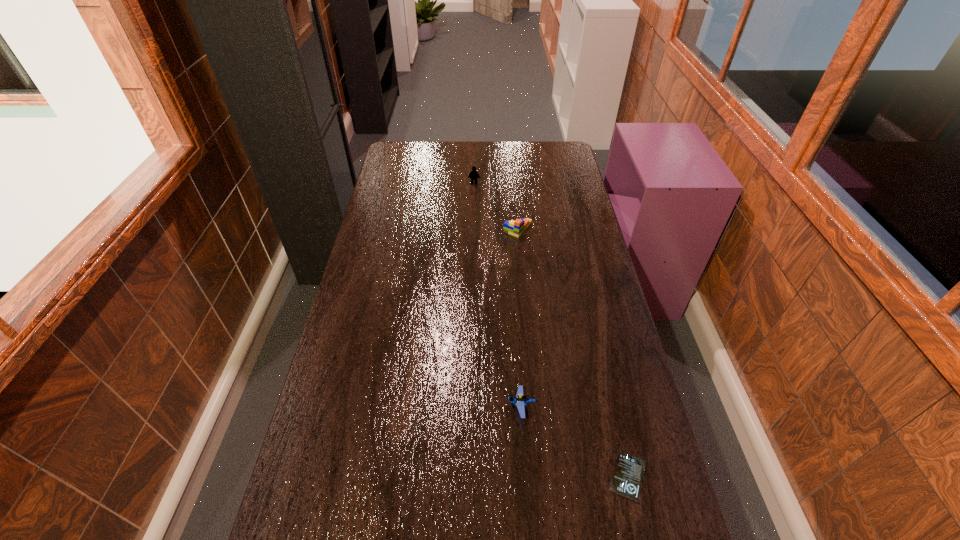
Image resolution: width=960 pixels, height=540 pixels. Identify the location of vacant area that lies between the second farthest Lego and the shortest Lego. (519, 318).

The width and height of the screenshot is (960, 540). I want to click on empty space between the third farthest object and the nearest object, so click(x=574, y=442).

Where is `vacant space that is in between the rightmost object and the nearest Lego`? The width and height of the screenshot is (960, 540). vacant space that is in between the rightmost object and the nearest Lego is located at coordinates (574, 442).

Identify the location of vacant area that lies between the nearest Lego and the leftmost object. The height and width of the screenshot is (540, 960). (497, 295).

I want to click on free space between the farthest Lego and the second tallest object, so click(496, 206).

What are the coordinates of `vacant area that lies between the second tallest Lego and the rightmost object` in the screenshot? It's located at (573, 353).

This screenshot has width=960, height=540. I want to click on free space between the rightmost object and the leftmost Lego, so click(x=551, y=330).

Find the location of a particular element. empty space that is in between the second shortest object and the shortest object is located at coordinates (574, 442).

Where is `free space between the second tallest Lego and the third tallest object`? free space between the second tallest Lego and the third tallest object is located at coordinates (519, 318).

This screenshot has width=960, height=540. I want to click on vacant region between the shortest Lego and the second nearest Lego, so click(519, 318).